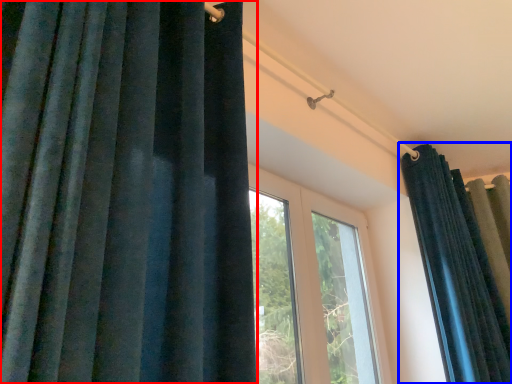
Question: Which point is further to the camera, curtain (highlighted by a red box) or curtain (highlighted by a blue box)?

Choices:
 (A) curtain
 (B) curtain

Answer: (B)